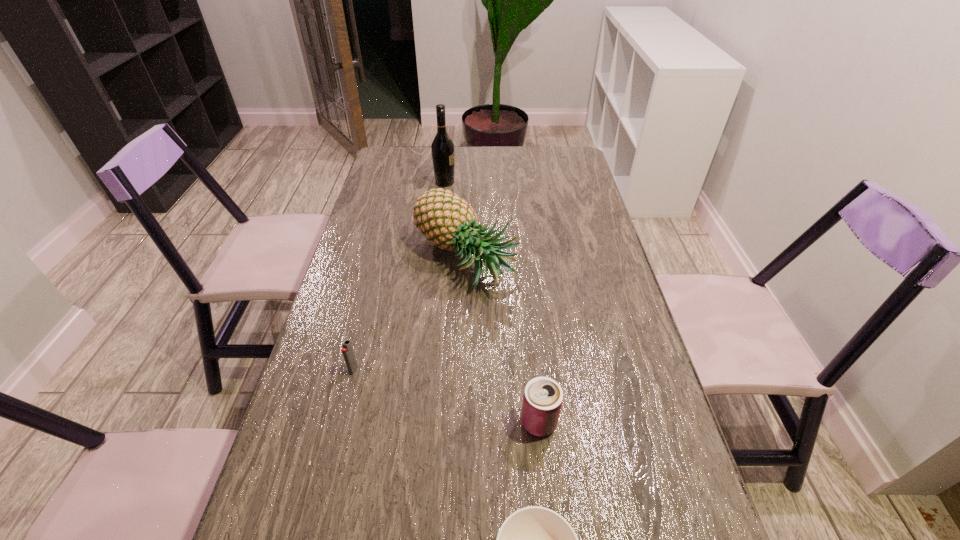
The height and width of the screenshot is (540, 960). In order to click on free location located on the back of the second shortest object in this screenshot , I will do [360, 345].

Identify the location of object positioned at the far edge. The image size is (960, 540). (442, 148).

Locate an element on the screen. The image size is (960, 540). object that is at the left edge is located at coordinates (347, 350).

Locate an element on the screen. This screenshot has width=960, height=540. vacant position at the far edge of the desktop is located at coordinates (494, 150).

Identify the location of free space at the left edge of the desktop. The height and width of the screenshot is (540, 960). (276, 538).

Find the location of a particular element. The width and height of the screenshot is (960, 540). vacant region at the right edge of the desktop is located at coordinates (636, 323).

At what (x,y) coordinates should I click in order to perform the action: click on free location at the far left corner. Please return your answer as a coordinate pair (x, y). The image size is (960, 540). Looking at the image, I should click on (406, 147).

In order to click on blank space at the far right corner in this screenshot , I will do [x=565, y=158].

This screenshot has height=540, width=960. Find the location of `free spot between the tallest object and the fourth farthest object`. free spot between the tallest object and the fourth farthest object is located at coordinates pyautogui.click(x=492, y=302).

The image size is (960, 540). In order to click on vacant space that's between the can and the igniter in this screenshot , I will do `click(446, 396)`.